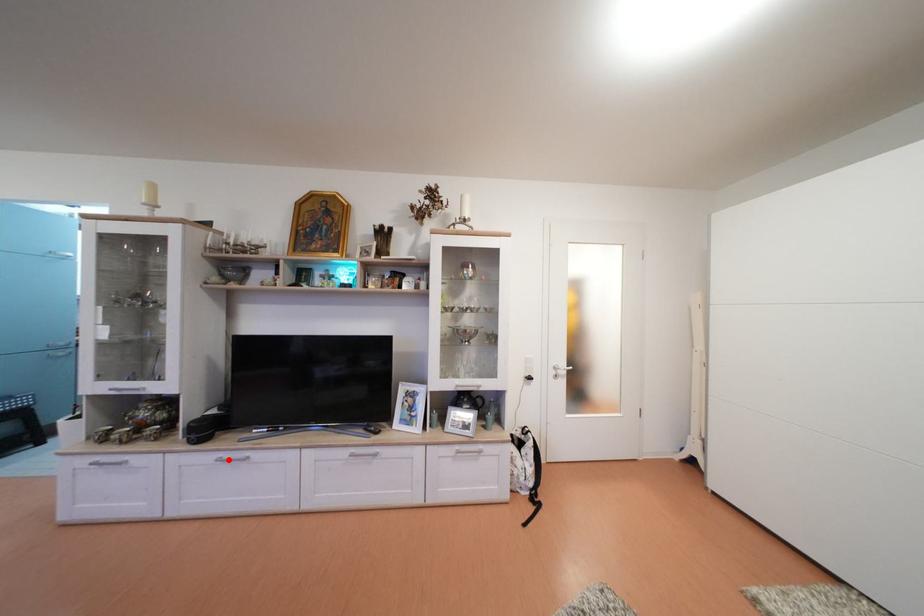
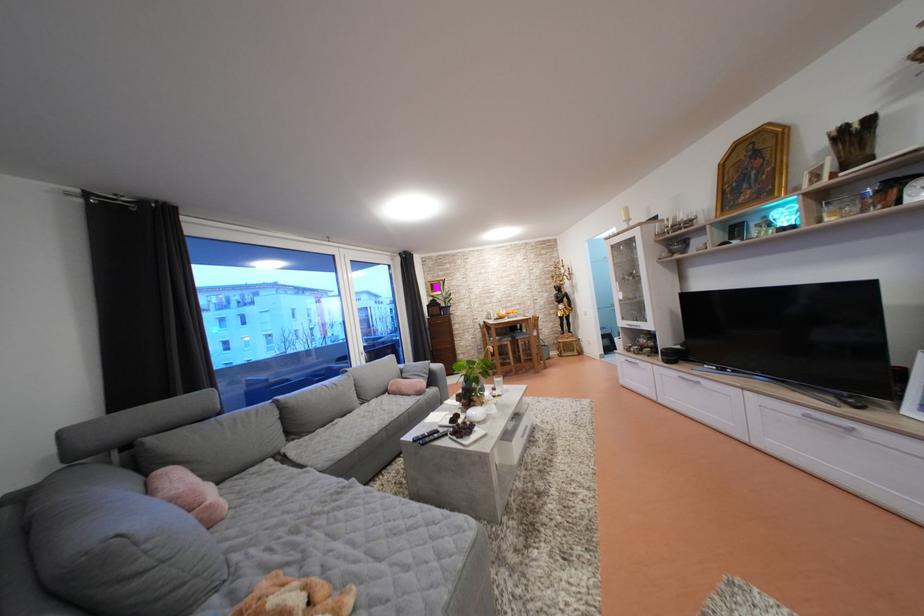
The point at the highlighted location is marked in the first image. Where is the corresponding point in the second image?

(688, 379)